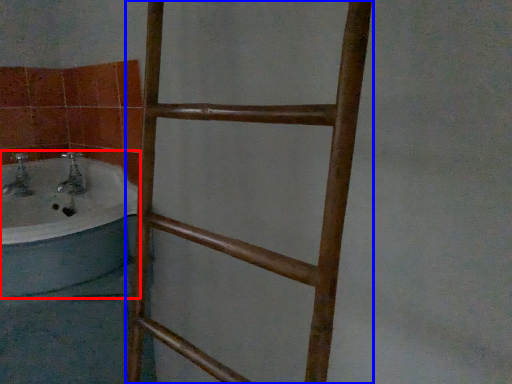
Question: Which of the following is the closest to the observer, bathtub (highlighted by a red box) or ladder (highlighted by a blue box)?

Choices:
 (A) bathtub
 (B) ladder

Answer: (B)